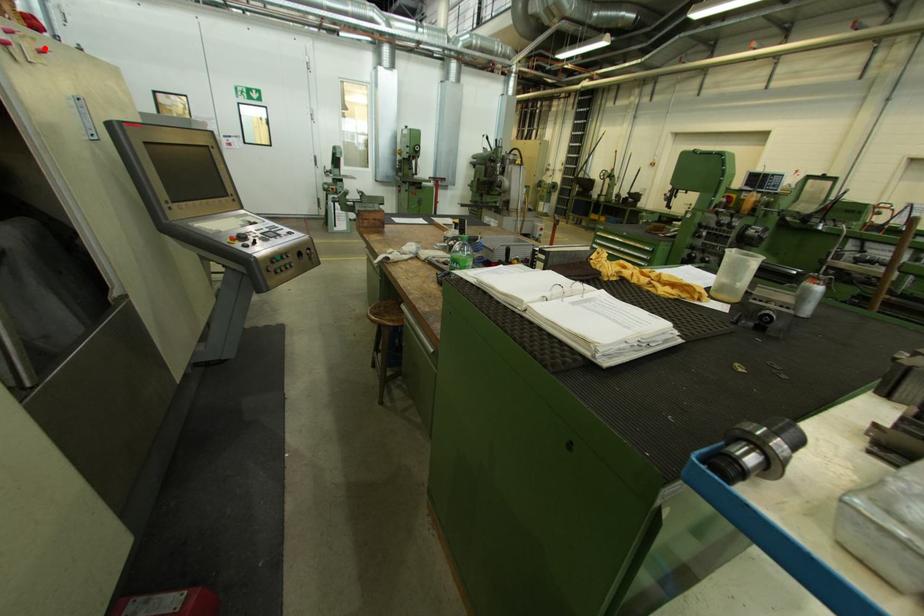
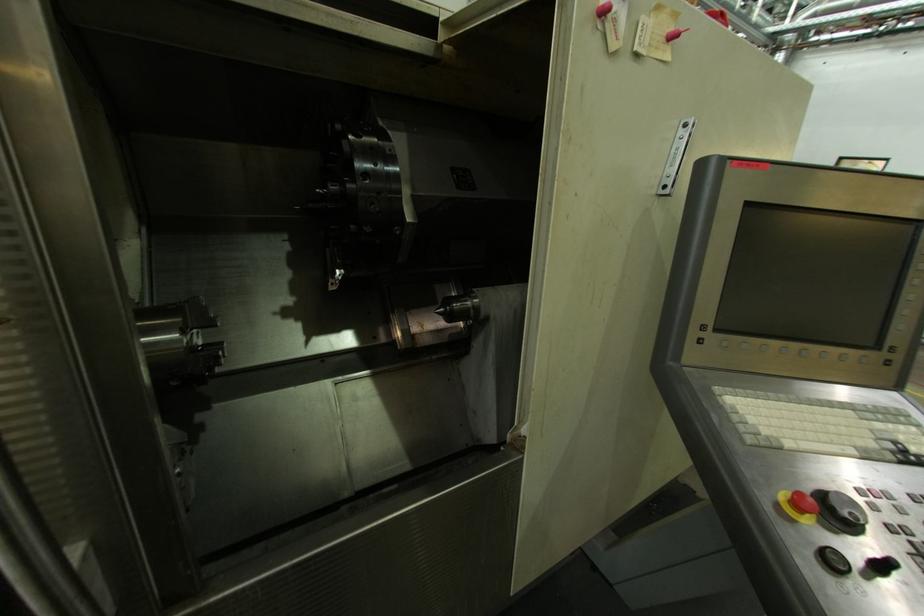
Question: I am providing you with two images of the same scene from different viewpoints. In image1, a red point is highlighted. Considering the same 3D point in image2, which of the following is correct?

Choices:
 (A) It is closer
 (B) It is farther

Answer: (A)